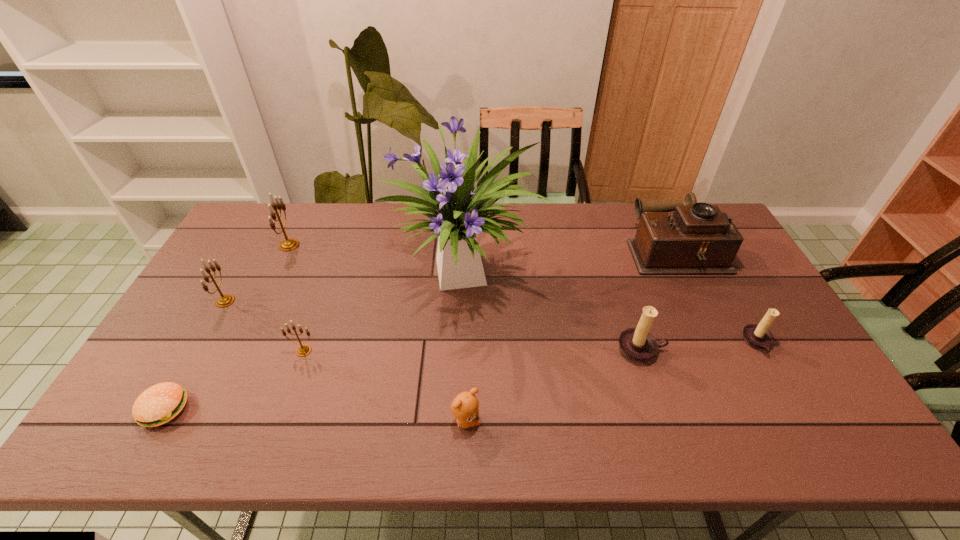
Locate an element on the screen. vacant region located on the horn of the phonograph_record is located at coordinates (558, 251).

The width and height of the screenshot is (960, 540). Find the location of `vacant region located on the back of the fourth nearest candelabrum`. vacant region located on the back of the fourth nearest candelabrum is located at coordinates (264, 232).

Find the location of a particular element. vacant area located 0.210m on the wick of the left brown candle holder is located at coordinates (671, 443).

I want to click on free space located on the wick of the right brown candle holder, so click(x=636, y=343).

At what (x,y) coordinates should I click in order to perform the action: click on free region located 0.310m on the wick of the right brown candle holder. Please return your answer as a coordinate pair (x, y). This screenshot has height=540, width=960. Looking at the image, I should click on (629, 343).

Where is `vacant space situated on the wick of the right brown candle holder`? This screenshot has height=540, width=960. vacant space situated on the wick of the right brown candle holder is located at coordinates (669, 343).

You are a GUI agent. You are given a task and a screenshot of the screen. Output one action in this format:
    pyautogui.click(x=<x>, y=<y>)
    Task: Click on the free space located 0.220m on the right of the third candelabrum from left to right
    
    Given the screenshot: What is the action you would take?
    pyautogui.click(x=399, y=350)

You are a GUI agent. You are given a task and a screenshot of the screen. Output one action in this format:
    pyautogui.click(x=<x>, y=<y>)
    Task: Click on the vacant space located 0.190m on the face of the brown teddy bear
    The image size is (960, 540).
    Given the screenshot: What is the action you would take?
    pyautogui.click(x=561, y=421)

This screenshot has width=960, height=540. What are the coordinates of `vacant space situated 0.080m on the back of the brown patty` in the screenshot? It's located at (191, 362).

At what (x,y) coordinates should I click in order to perform the action: click on flower arrangement positioned at the far edge. Please return your answer as a coordinate pair (x, y). The image size is (960, 540). Looking at the image, I should click on (462, 213).